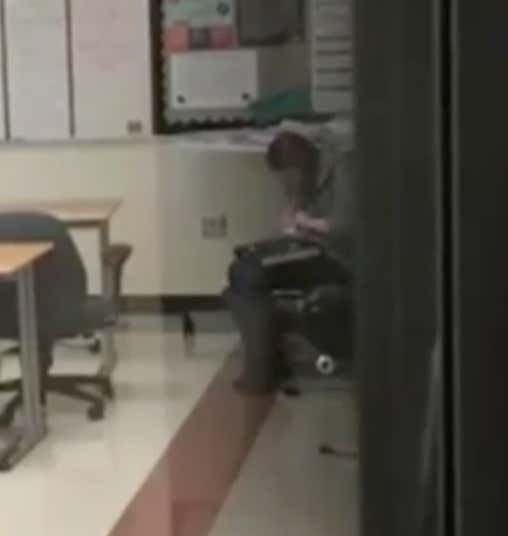
The width and height of the screenshot is (508, 536). What are the coordinates of `wall` in the screenshot? It's located at (150, 217).